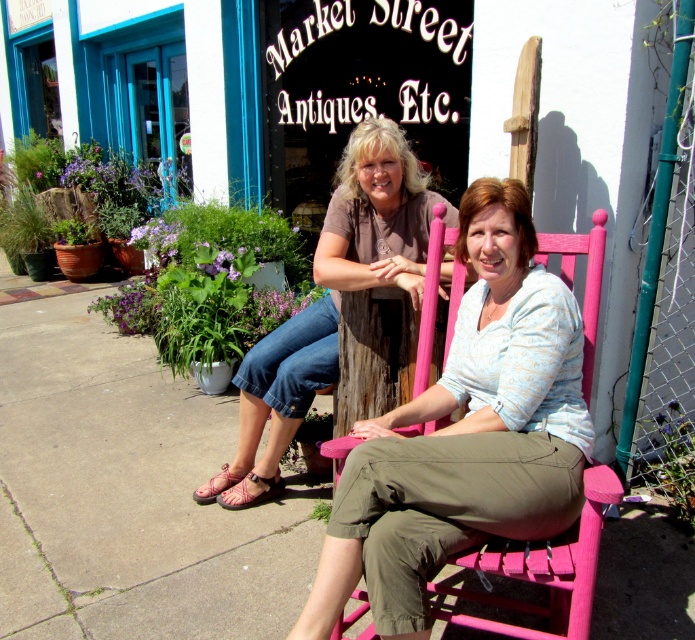
Is matte brown shirt at center below pink painted wood rocking chair at center?

Actually, matte brown shirt at center is above pink painted wood rocking chair at center.

Can you confirm if matte brown shirt at center is positioned to the right of pink painted wood rocking chair at center?

No, matte brown shirt at center is not to the right of pink painted wood rocking chair at center.

Where is `matte brown shirt at center`? matte brown shirt at center is located at coordinates (327, 301).